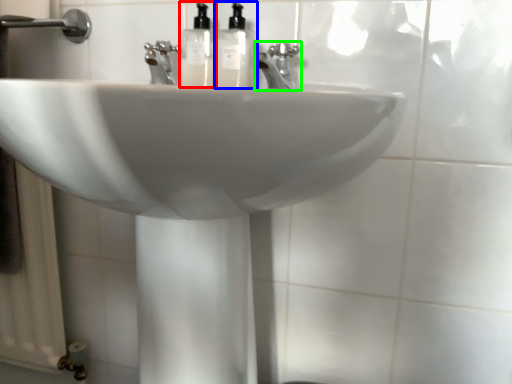
Question: Considering the real-world distances, which object is closest to soap dispenser (highlighted by a red box)? soap dispenser (highlighted by a blue box) or tap (highlighted by a green box).

Choices:
 (A) soap dispenser
 (B) tap

Answer: (A)